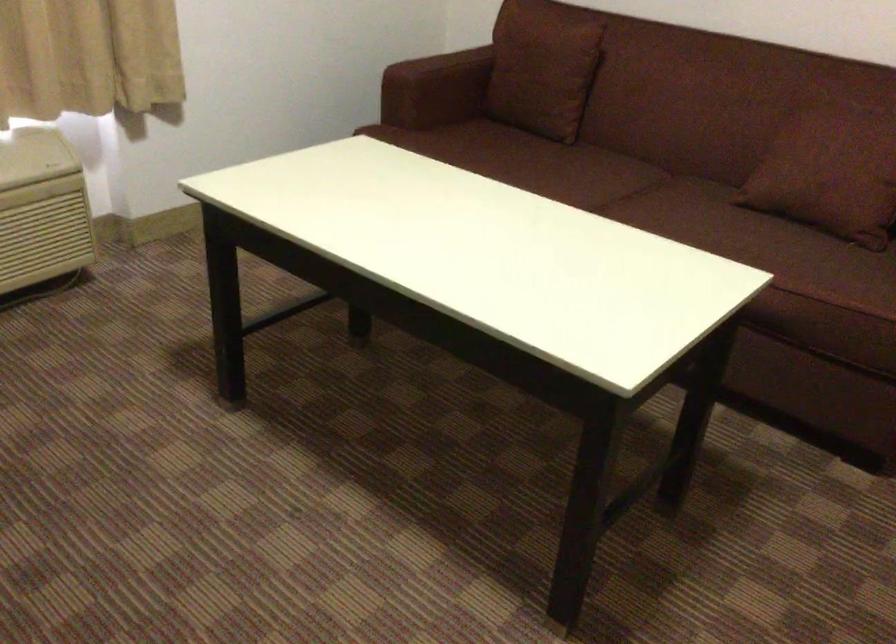
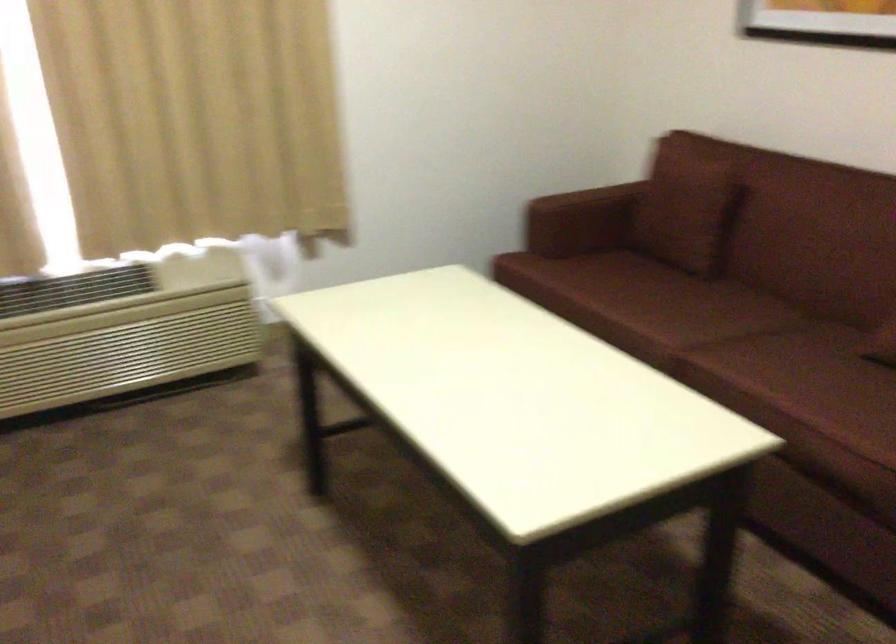
Question: In a continuous first-person perspective shot, in which direction is the camera moving?

Choices:
 (A) Left
 (B) Right
 (C) Forward
 (D) Backward

Answer: (B)